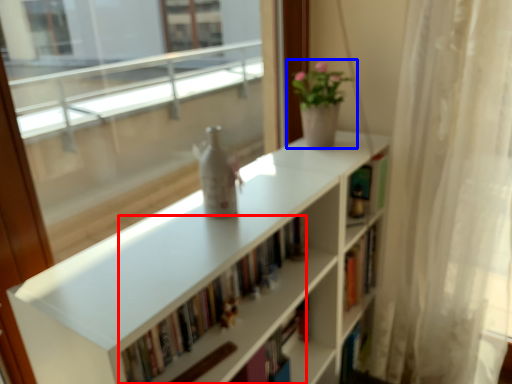
Question: Which point is further to the camera, book (highlighted by a red box) or houseplant (highlighted by a blue box)?

Choices:
 (A) book
 (B) houseplant

Answer: (B)